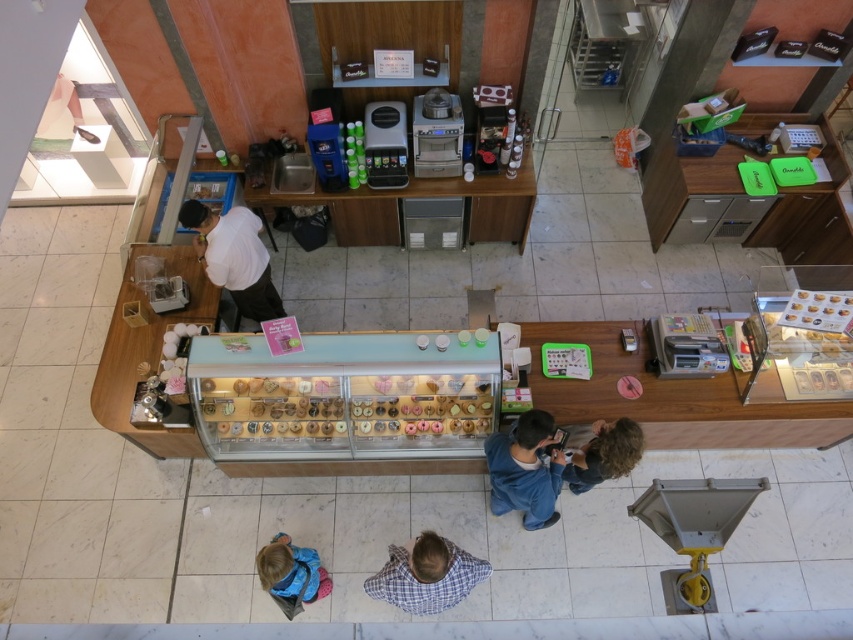
Question: Which point appears closest to the camera in this image?

Choices:
 (A) (263, 317)
 (B) (468, 556)
 (C) (293, 616)
 (D) (584, 449)

Answer: (B)

Question: Which of these objects is positioned closest to the white matte shirt at upper left?

Choices:
 (A) blue cotton shirt at lower center
 (B) blue plaid shirt at center

Answer: (A)

Question: Does blue plaid shirt at center have a lesser width compared to curly hair at lower right?

Choices:
 (A) yes
 (B) no

Answer: (B)

Question: Which object appears farthest from the camera in this image?

Choices:
 (A) blue cotton shirt at lower center
 (B) curly hair at lower right
 (C) blue plaid shirt at center

Answer: (B)

Question: Can you confirm if white matte shirt at upper left is smaller than blue fleece jacket at lower left?

Choices:
 (A) no
 (B) yes

Answer: (A)

Question: Does white matte shirt at upper left appear on the right side of curly hair at lower right?

Choices:
 (A) yes
 (B) no

Answer: (B)